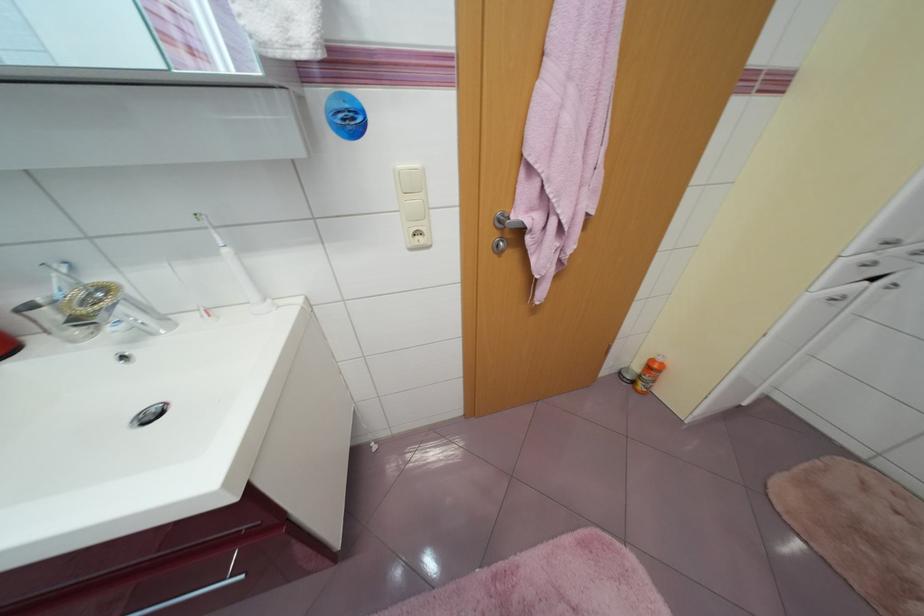
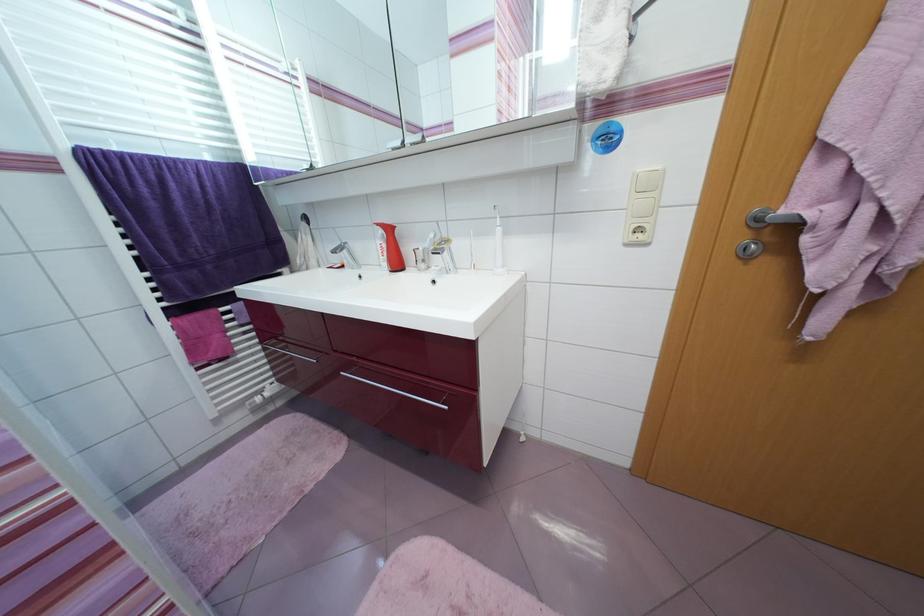
In the second image, find the point that corresponds to (x=500, y=237) in the first image.

(748, 238)